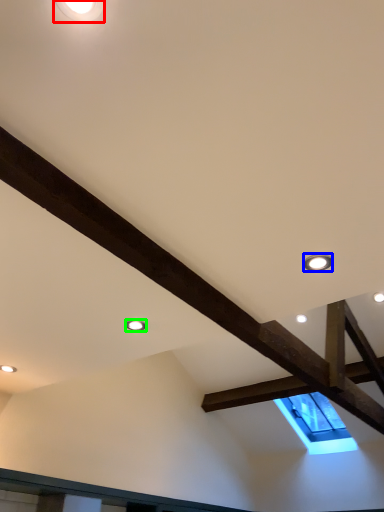
Question: Which object is positioned farthest from droplight (highlighted by a red box)? Select from droplight (highlighted by a blue box) and droplight (highlighted by a green box).

Choices:
 (A) droplight
 (B) droplight

Answer: (B)